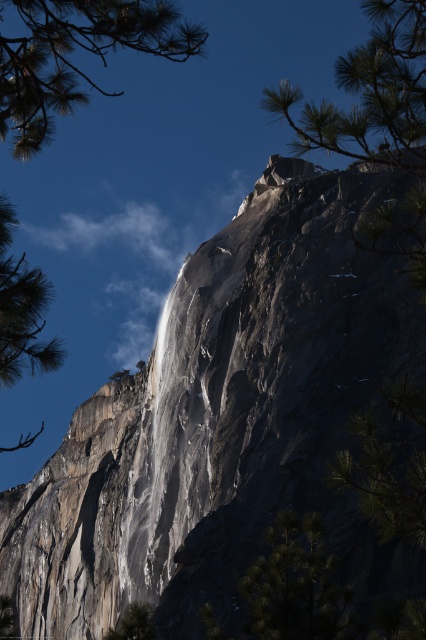
Question: Is green textured rock at upper center positioned in front of green textured tree at lower center?

Choices:
 (A) no
 (B) yes

Answer: (B)

Question: Considering the real-world distances, which object is closest to the green pine branch at upper left?

Choices:
 (A) green textured tree at lower center
 (B) green textured rock at upper center

Answer: (B)

Question: Is green textured rock at upper center bigger than green pine branch at upper left?

Choices:
 (A) yes
 (B) no

Answer: (B)

Question: Which object is the farthest from the green textured tree at lower center?

Choices:
 (A) green textured rock at upper center
 (B) green pine branch at upper left

Answer: (B)

Question: Can you confirm if green textured pine tree at left is positioned above green textured tree at lower center?

Choices:
 (A) yes
 (B) no

Answer: (A)

Question: Which of the following is the closest to the observer?

Choices:
 (A) (25, 317)
 (B) (91, 13)
 (C) (357, 83)
 (D) (143, 634)

Answer: (A)